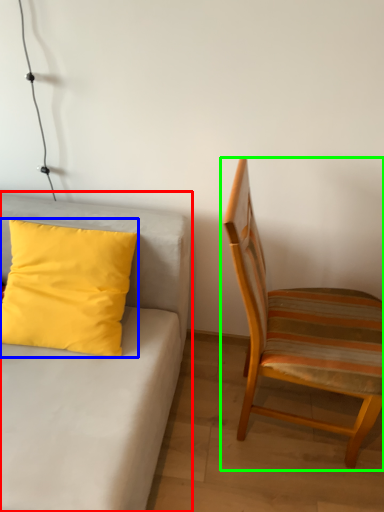
Question: Which object is positioned farthest from studio couch (highlighted by a red box)? Select from pillow (highlighted by a blue box) and chair (highlighted by a green box).

Choices:
 (A) pillow
 (B) chair

Answer: (B)